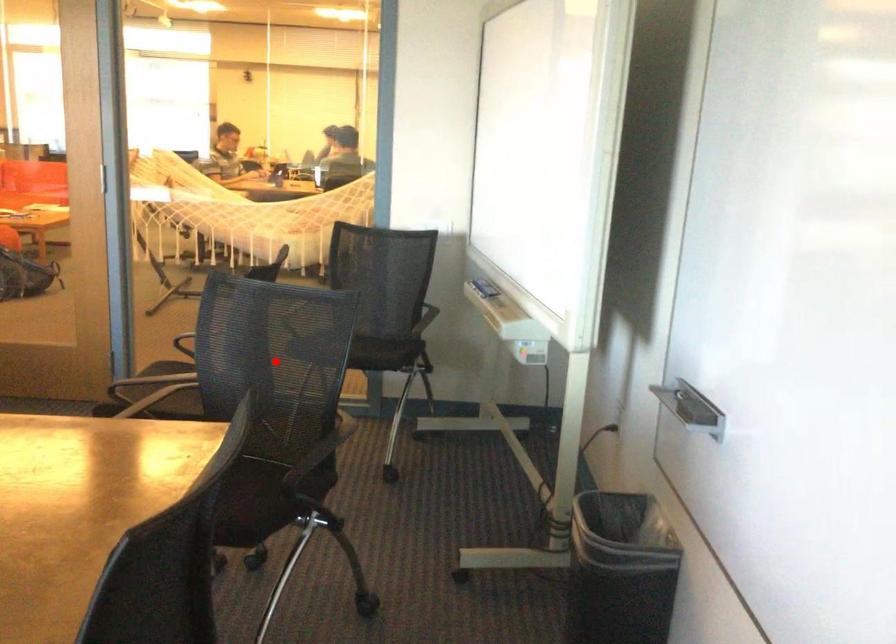
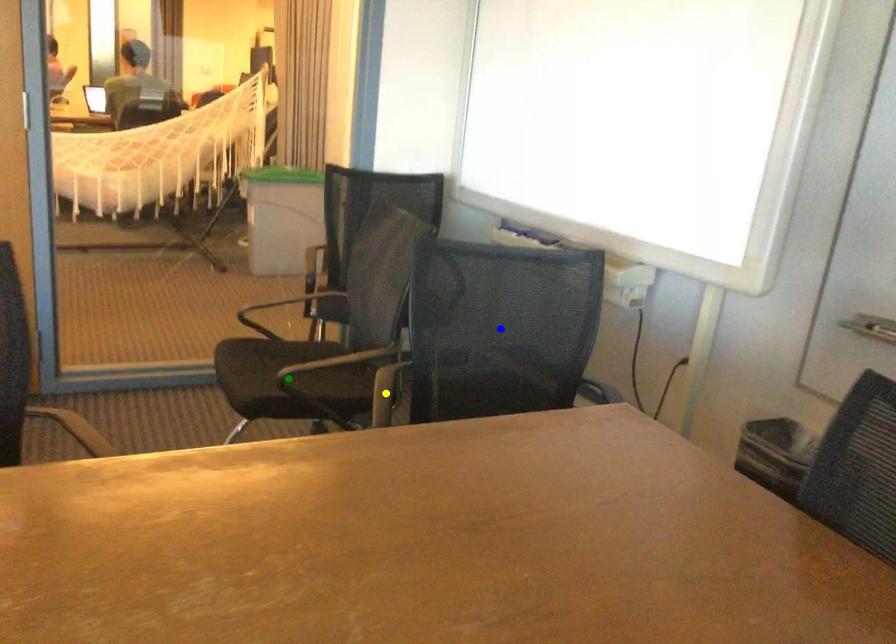
Question: I am providing you with two images of the same scene from different viewpoints. A red point is marked on the first image. You are given multiple points on the second image. Which mark in image 2 goes with the point in image 1?

Choices:
 (A) blue point
 (B) yellow point
 (C) green point

Answer: (A)